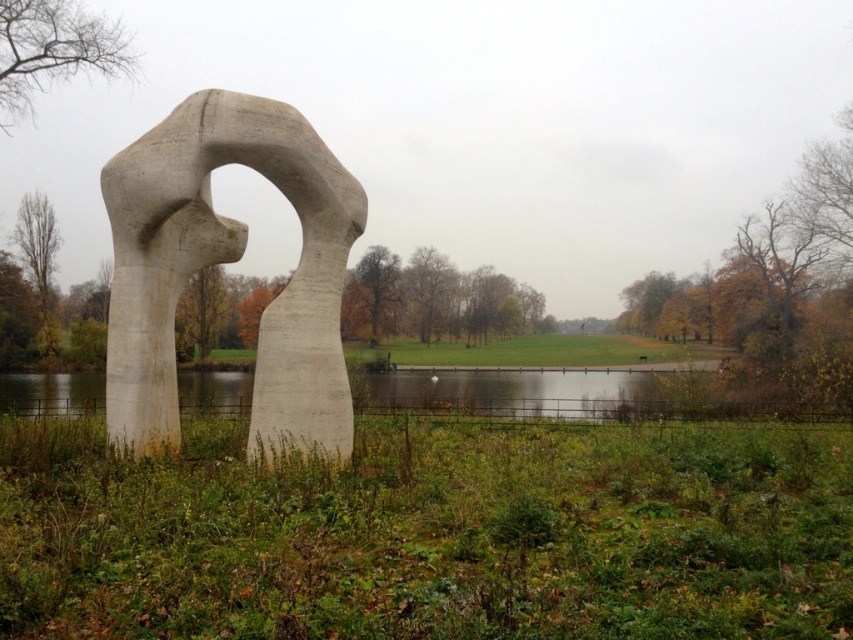
You are standing in the outdoor scene and want to walk from the white concrete sculpture at center to the transparent water at center. Is the path directly between them level, or does it slope upward or downward?

The white concrete sculpture at center is above transparent water at center, so the path between them slopes downward toward the transparent water at center.

You are standing at the point marked by the coordinates point (225, 262) in the image. What object are you directly in front of?

You are directly in front of the white concrete sculpture at center, as the point (225, 262) represents its location.

You are standing in the outdoor scene and want to take a photo of the transparent water at center. To avoid blocking the view of the white concrete sculpture at center in the background, should you position yourself to the left or right of the water?

You should position yourself to the left of the transparent water at center because the white concrete sculpture at center is located to the right of the water, so standing on the left side will keep the sculpture visible in the background without obstruction.